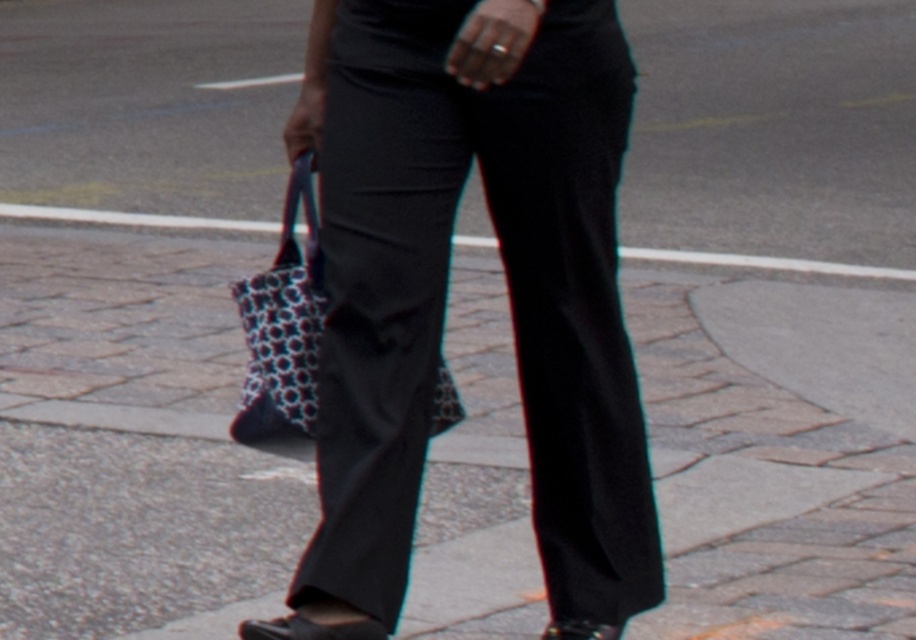
Consider the image. You are a photographer standing at the camera position. The subject is wearing black smooth pants at center. If you want to capture a full body shot of the subject, would you need to adjust your distance? Explain why.

The black smooth pants at center and the camera are 4.02 meters apart. To capture a full body shot, you would need to move closer because 4.02 meters might be too far for a full body composition, depending on the lens used. However, the exact adjustment depends on the camera equipment available.